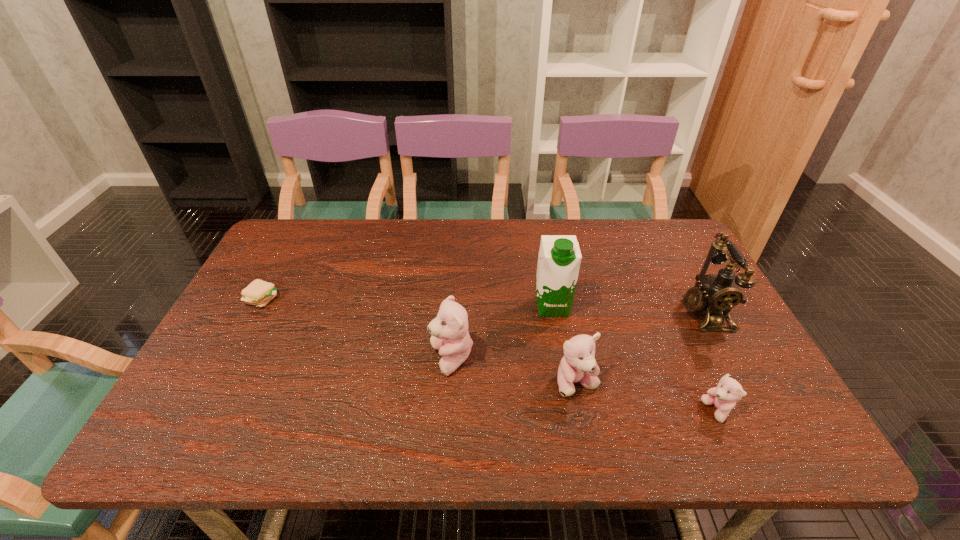
Please show where to add a teddy bear on the left while keeping spacing even. Please provide its 2D coordinates. Your answer should be formatted as a tuple, i.e. [(x, y)], where the tuple contains the x and y coordinates of a point satisfying the conditions above.

[(338, 337)]